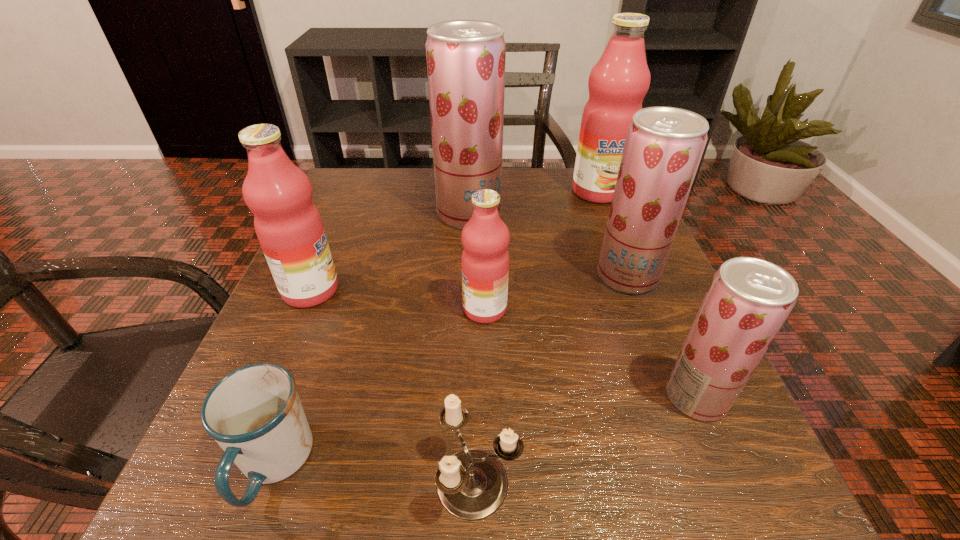
Locate an element on the screen. This screenshot has height=540, width=960. vacant area that lies between the nearest fruit juice and the leftmost pink fruit juice is located at coordinates (504, 343).

Where is `object that is the second nearest to the candle holder`? The height and width of the screenshot is (540, 960). object that is the second nearest to the candle holder is located at coordinates (485, 237).

Identify which object is the third closest to the second pink fruit juice from right to left. Please provide its 2D coordinates. Your answer should be formatted as a tuple, i.e. [(x, y)], where the tuple contains the x and y coordinates of a point satisfying the conditions above.

[(472, 484)]

Point out which fruit juice is positioned as the nearest to the second biggest pink fruit juice. Please provide its 2D coordinates. Your answer should be formatted as a tuple, i.e. [(x, y)], where the tuple contains the x and y coordinates of a point satisfying the conditions above.

[(465, 58)]

Where is `fruit juice that is the second nearest to the leftmost pink fruit juice`? This screenshot has width=960, height=540. fruit juice that is the second nearest to the leftmost pink fruit juice is located at coordinates (485, 237).

You are a GUI agent. You are given a task and a screenshot of the screen. Output one action in this format:
    pyautogui.click(x=<x>, y=<y>)
    Task: Click on the strawberry fruit juice object that ranks as the third closest to the biggest pink fruit juice
    This screenshot has width=960, height=540.
    Given the screenshot: What is the action you would take?
    pyautogui.click(x=749, y=299)

Locate which strawberry fruit juice is the closest to the nearest strawberry fruit juice. Please provide its 2D coordinates. Your answer should be formatted as a tuple, i.e. [(x, y)], where the tuple contains the x and y coordinates of a point satisfying the conditions above.

[(664, 145)]

Identify the location of pink fruit juice identified as the third closest to the second nearest strawberry fruit juice. (288, 225).

Identify which pink fruit juice is the second closest to the farthest pink fruit juice. Please provide its 2D coordinates. Your answer should be formatted as a tuple, i.e. [(x, y)], where the tuple contains the x and y coordinates of a point satisfying the conditions above.

[(288, 225)]

What are the coordinates of `free space that satisfies the following two spatial constraints: 1. on the label of the second pink fruit juice from right to left; 2. on the handle side of the mug` in the screenshot? It's located at (487, 465).